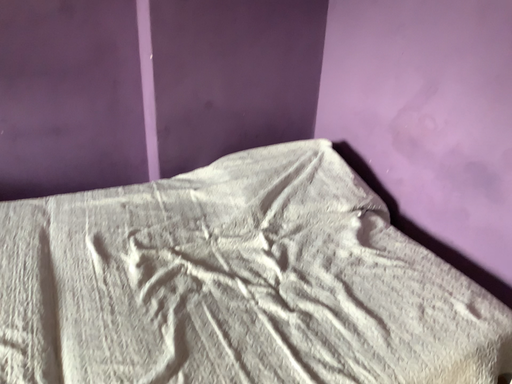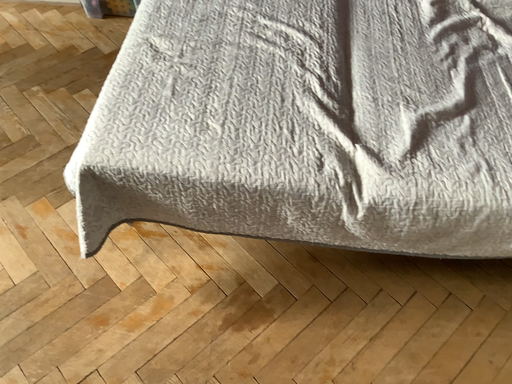
Question: How did the camera likely rotate when shooting the video?

Choices:
 (A) rotated downward
 (B) rotated upward

Answer: (A)